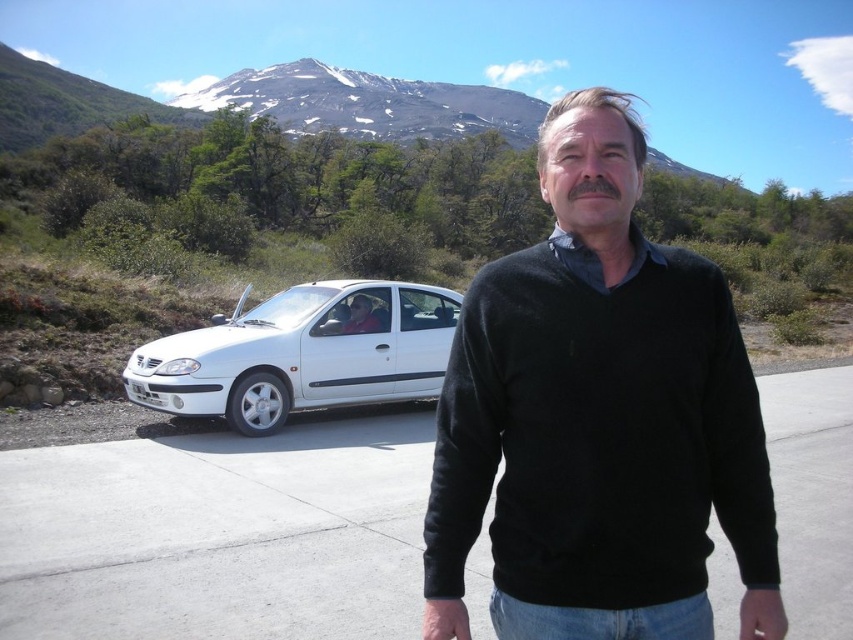
Where is the black sweater at center located in the image?

The black sweater at center is located at point 0.656 on the x axis and 0.702 on the y axis.

You are a photographer trying to capture a photo of the black sweater at center and the white matte sedan at left. Which object should you focus on first if you want to ensure both are in focus without changing the camera settings?

The black sweater at center is below the white matte sedan at left, so focusing on the white matte sedan at left first would ensure both are in focus since it is further away and the depth of field would cover the closer black sweater at center.